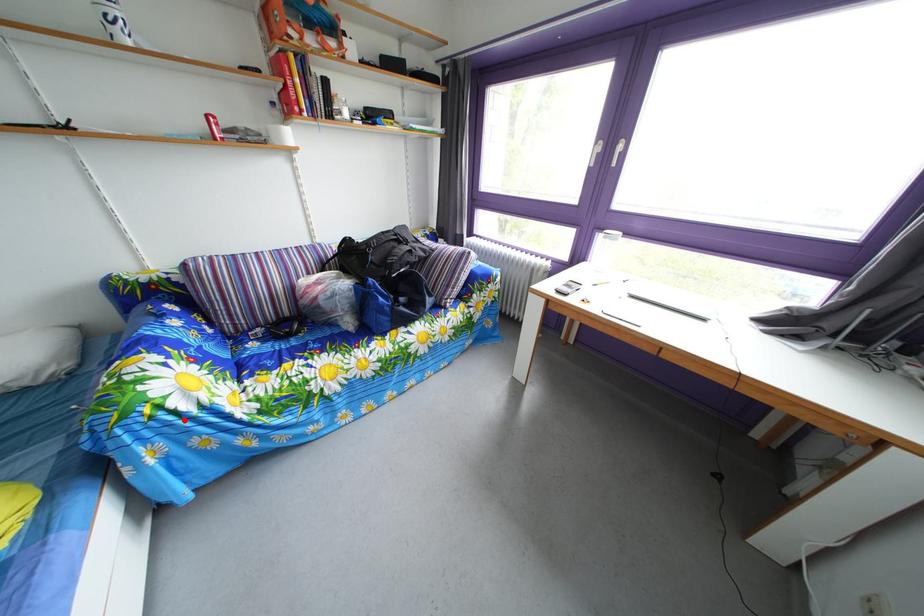
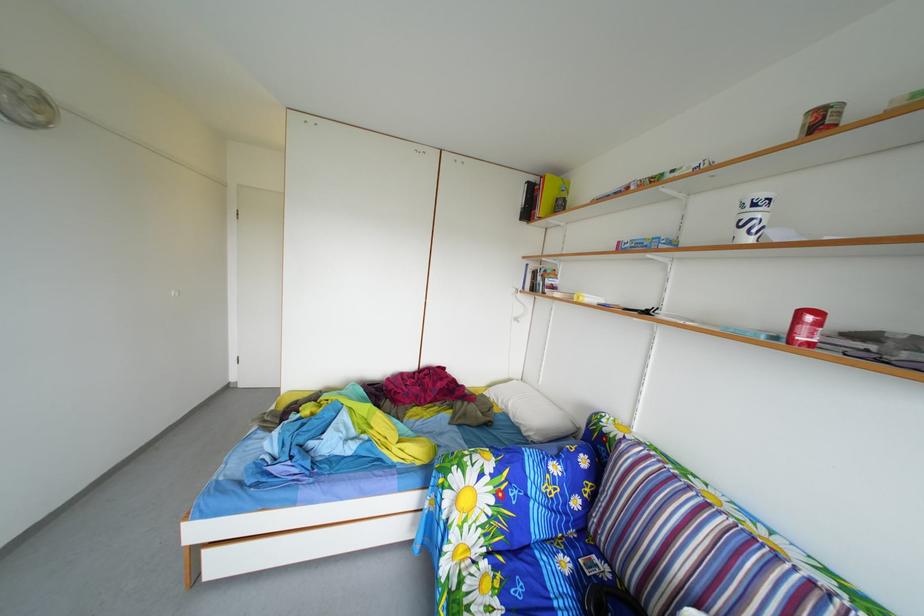
The point at the highlighted location is marked in the first image. Where is the corresponding point in the second image?

(453, 507)